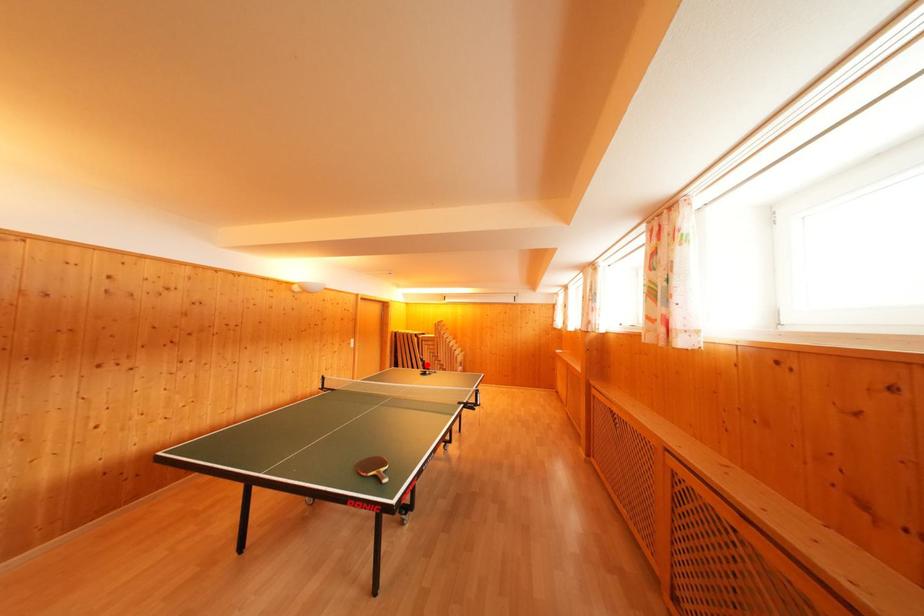
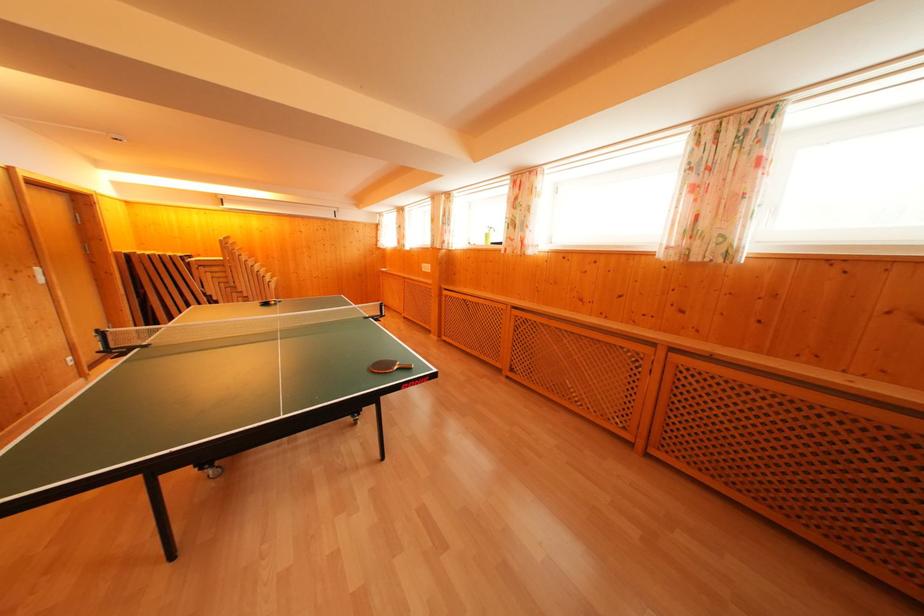
Question: I am providing you with two images of the same scene from different viewpoints. In image1, a red point is highlighted. Considering the same 3D point in image2, which of the following is correct?

Choices:
 (A) It is closer
 (B) It is farther

Answer: (A)